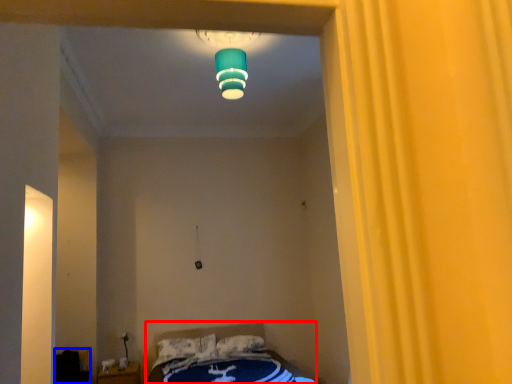
Question: Among these objects, which one is nearest to the camera, bed (highlighted by a red box) or furniture (highlighted by a blue box)?

Choices:
 (A) bed
 (B) furniture

Answer: (A)